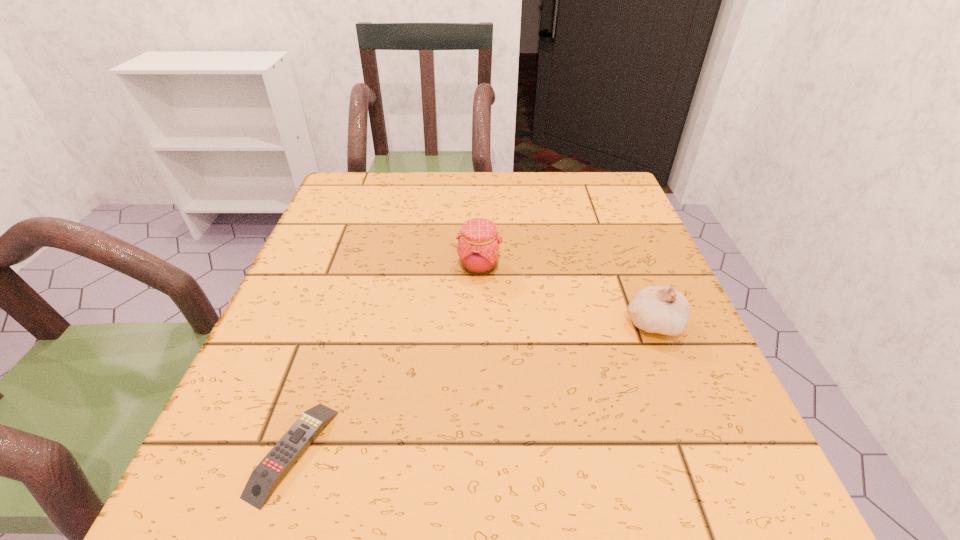
Where is `object that is at the left edge`? object that is at the left edge is located at coordinates (263, 480).

Find the location of `object that is at the right edge`. object that is at the right edge is located at coordinates (663, 310).

This screenshot has height=540, width=960. In order to click on object located at the near left corner in this screenshot , I will do `click(263, 480)`.

Find the location of a particular element. The height and width of the screenshot is (540, 960). vacant region at the left edge of the desktop is located at coordinates (282, 366).

In the image, there is a desktop. At what (x,y) coordinates should I click in order to perform the action: click on vacant space at the right edge. Please return your answer as a coordinate pair (x, y). The width and height of the screenshot is (960, 540). Looking at the image, I should click on (645, 228).

Find the location of a particular element. Image resolution: width=960 pixels, height=540 pixels. free spot at the far left corner of the desktop is located at coordinates [342, 194].

I want to click on vacant region at the near left corner of the desktop, so click(x=215, y=475).

Find the location of a particular element. This screenshot has height=540, width=960. free space at the far right corner of the desktop is located at coordinates pyautogui.click(x=566, y=187).

Find the location of a particular element. The height and width of the screenshot is (540, 960). free space at the near right corner is located at coordinates tap(702, 494).

The image size is (960, 540). I want to click on vacant area that lies between the second object from right to left and the rightmost object, so click(566, 295).